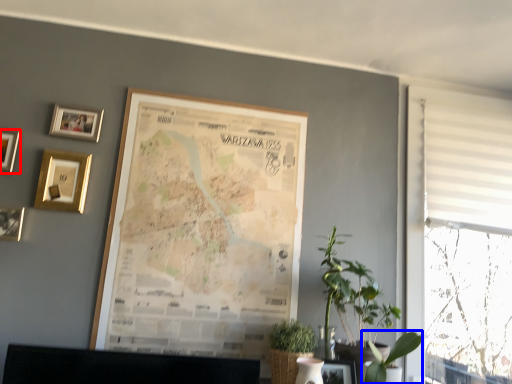
Question: Which object appears farthest to the camera in this image, picture frame (highlighted by a red box) or plant (highlighted by a blue box)?

Choices:
 (A) picture frame
 (B) plant

Answer: (A)